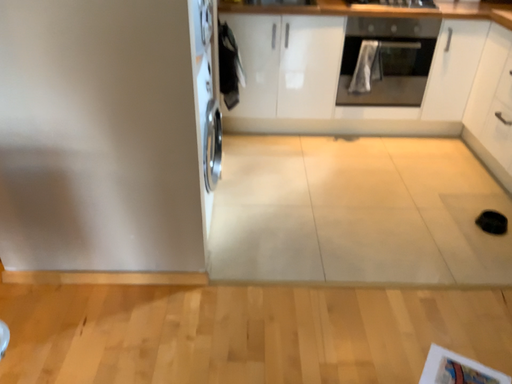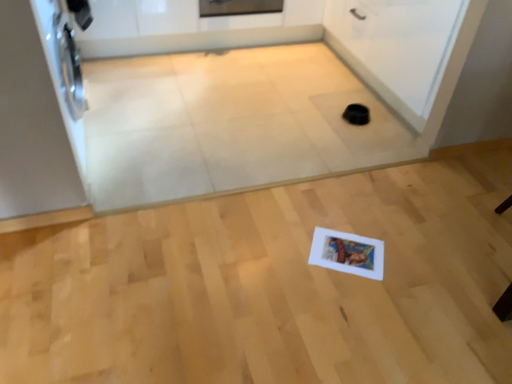
Question: Which way did the camera rotate in the video?

Choices:
 (A) rotated right
 (B) rotated left

Answer: (A)